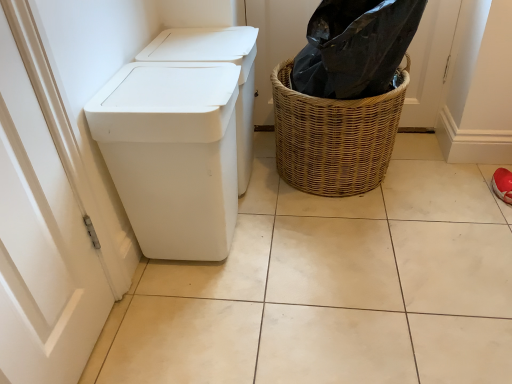
Question: Is white matte tile at center in front of or behind woven brown basket at right in the image?

Choices:
 (A) front
 (B) behind

Answer: (A)

Question: Choose the correct answer: Is white matte tile at center inside woven brown basket at right or outside it?

Choices:
 (A) outside
 (B) inside

Answer: (A)

Question: Estimate the real-world distances between objects in this image. Which object is closer to the woven brown basket at right?

Choices:
 (A) white plastic waste container at left
 (B) white matte tile at center

Answer: (B)

Question: Estimate the real-world distances between objects in this image. Which object is farther from the white plastic waste container at left?

Choices:
 (A) white matte tile at center
 (B) woven brown basket at right

Answer: (B)